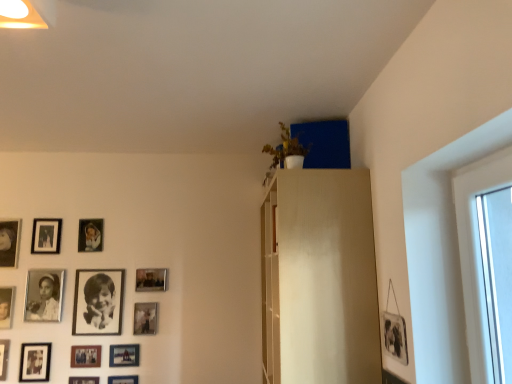
Question: Is matte black picture frame at lower left, arranged as the 9th picture frame when viewed from the left, oriented towards black matte picture frame at lower left, the 11th picture frame when ordered from right to left?

Choices:
 (A) no
 (B) yes

Answer: (A)

Question: Is matte black picture frame at lower left, the 6th picture frame in the right-to-left sequence, positioned with its back to black matte picture frame at lower left, positioned as the 4th picture frame in left-to-right order?

Choices:
 (A) no
 (B) yes

Answer: (A)

Question: Is matte black picture frame at lower left, the 6th picture frame in the right-to-left sequence, in contact with black matte picture frame at lower left, positioned as the 4th picture frame in left-to-right order?

Choices:
 (A) yes
 (B) no

Answer: (B)

Question: Is matte black picture frame at lower left, the 6th picture frame in the right-to-left sequence, bigger than black matte picture frame at lower left, positioned as the 4th picture frame in left-to-right order?

Choices:
 (A) no
 (B) yes

Answer: (A)

Question: Does matte black picture frame at lower left, the 6th picture frame in the right-to-left sequence, have a lesser height compared to black matte picture frame at lower left, the 11th picture frame when ordered from right to left?

Choices:
 (A) no
 (B) yes

Answer: (B)

Question: From the image's perspective, is matte black picture frame at lower left, the 6th picture frame in the right-to-left sequence, above black matte picture frame at lower left, the 11th picture frame when ordered from right to left?

Choices:
 (A) no
 (B) yes

Answer: (B)

Question: Is matte wood dresser at upper center behind metallic silver picture frame at lower center, the 14th picture frame in the left-to-right sequence?

Choices:
 (A) no
 (B) yes

Answer: (A)

Question: Is matte wood dresser at upper center aimed at metallic silver picture frame at lower center, the 14th picture frame in the left-to-right sequence?

Choices:
 (A) yes
 (B) no

Answer: (A)

Question: Can you confirm if matte wood dresser at upper center is bigger than metallic silver picture frame at lower center, placed as the first picture frame when sorted from right to left?

Choices:
 (A) no
 (B) yes

Answer: (B)

Question: Considering the relative sizes of matte wood dresser at upper center and metallic silver picture frame at lower center, the 14th picture frame in the left-to-right sequence, in the image provided, is matte wood dresser at upper center thinner than metallic silver picture frame at lower center, the 14th picture frame in the left-to-right sequence,?

Choices:
 (A) yes
 (B) no

Answer: (B)

Question: From the image's perspective, does matte wood dresser at upper center appear lower than metallic silver picture frame at lower center, the 14th picture frame in the left-to-right sequence?

Choices:
 (A) no
 (B) yes

Answer: (A)

Question: Is matte wood dresser at upper center positioned in front of metallic silver picture frame at lower center, the 14th picture frame in the left-to-right sequence?

Choices:
 (A) yes
 (B) no

Answer: (A)

Question: Can you confirm if black matte photo frame at lower left, which is the sixth picture frame from left to right, is smaller than matte black picture frame at upper left, which is the 7th picture frame from left to right?

Choices:
 (A) no
 (B) yes

Answer: (A)